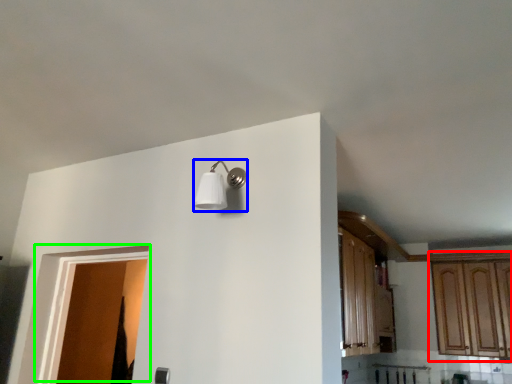
Question: Considering the real-world distances, which object is closest to cabinetry (highlighted by a red box)? light fixture (highlighted by a blue box) or door (highlighted by a green box).

Choices:
 (A) light fixture
 (B) door

Answer: (A)